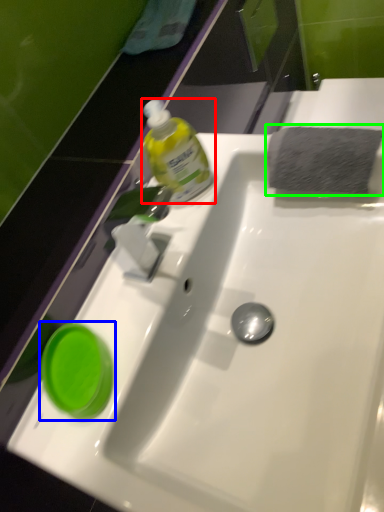
Question: Estimate the real-world distances between objects in this image. Which object is farther from bottle (highlighted by a red box), teal (highlighted by a blue box) or hand towel (highlighted by a green box)?

Choices:
 (A) teal
 (B) hand towel

Answer: (A)